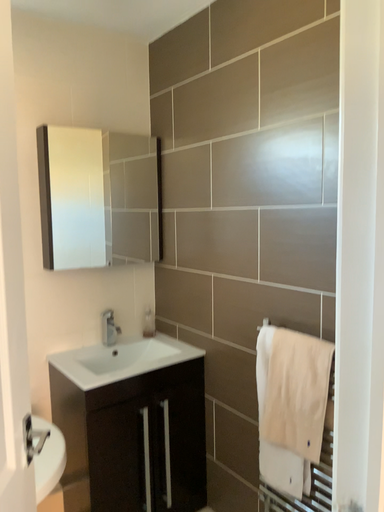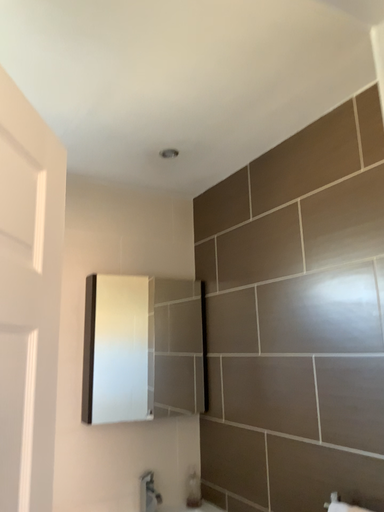
Question: How did the camera likely rotate when shooting the video?

Choices:
 (A) rotated upward
 (B) rotated downward

Answer: (A)